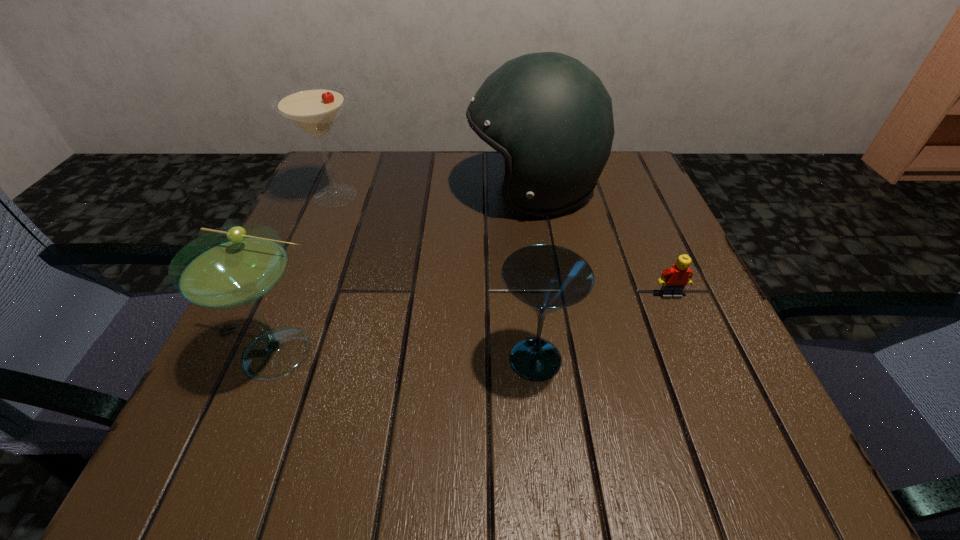
Identify the location of vacant space situated 0.390m on the back of the shortest martini. The width and height of the screenshot is (960, 540). (517, 193).

This screenshot has height=540, width=960. Identify the location of vacant space located on the front-facing side of the third nearest object. click(x=732, y=441).

Image resolution: width=960 pixels, height=540 pixels. In order to click on football helmet positioned at the far edge in this screenshot , I will do `click(550, 116)`.

Identify the location of martini that is at the far edge. (314, 109).

I want to click on football helmet located in the right edge section of the desktop, so click(550, 116).

Identify the location of Lego located in the right edge section of the desktop. (674, 279).

Locate an element on the screen. The width and height of the screenshot is (960, 540). object at the far left corner is located at coordinates (314, 109).

Locate an element on the screen. object located at the far right corner is located at coordinates (550, 116).

This screenshot has height=540, width=960. In the image, there is a desktop. Find the location of `vacant space at the far edge`. vacant space at the far edge is located at coordinates (426, 152).

The height and width of the screenshot is (540, 960). In order to click on free space at the near edge in this screenshot , I will do `click(450, 468)`.